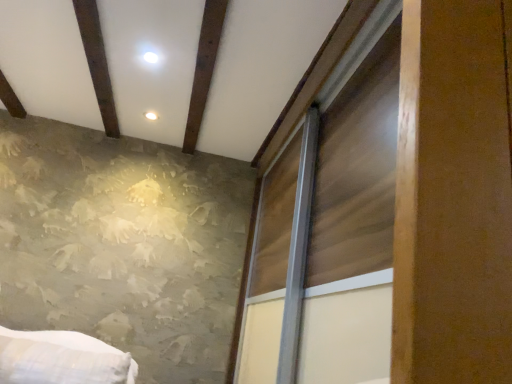
Question: Is brown wooden plank at upper center positioned far away from wooden sliding door at right?

Choices:
 (A) no
 (B) yes

Answer: (A)

Question: Is brown wooden plank at upper center wider than wooden sliding door at right?

Choices:
 (A) no
 (B) yes

Answer: (A)

Question: From the image's perspective, is brown wooden plank at upper center on wooden sliding door at right?

Choices:
 (A) no
 (B) yes

Answer: (B)

Question: Could wooden sliding door at right be considered to be inside brown wooden plank at upper center?

Choices:
 (A) no
 (B) yes

Answer: (A)

Question: Is brown wooden plank at upper center positioned with its back to wooden sliding door at right?

Choices:
 (A) yes
 (B) no

Answer: (A)

Question: Is brown wooden plank at upper center placed right next to wooden sliding door at right?

Choices:
 (A) no
 (B) yes

Answer: (A)

Question: From a real-world perspective, is wooden sliding door at right positioned under brown wooden plank at upper center based on gravity?

Choices:
 (A) no
 (B) yes

Answer: (B)

Question: Considering the relative sizes of wooden sliding door at right and brown wooden plank at upper center in the image provided, is wooden sliding door at right bigger than brown wooden plank at upper center?

Choices:
 (A) no
 (B) yes

Answer: (B)

Question: Is wooden sliding door at right positioned with its back to brown wooden plank at upper center?

Choices:
 (A) yes
 (B) no

Answer: (B)

Question: Considering the relative sizes of wooden sliding door at right and brown wooden plank at upper center in the image provided, is wooden sliding door at right smaller than brown wooden plank at upper center?

Choices:
 (A) yes
 (B) no

Answer: (B)

Question: Is wooden sliding door at right wider than brown wooden plank at upper center?

Choices:
 (A) no
 (B) yes

Answer: (B)

Question: Could you tell me if wooden sliding door at right is turned towards brown wooden plank at upper center?

Choices:
 (A) no
 (B) yes

Answer: (B)

Question: Considering the positions of wooden sliding door at right and brown wooden plank at upper center in the image, is wooden sliding door at right wider or thinner than brown wooden plank at upper center?

Choices:
 (A) wide
 (B) thin

Answer: (A)